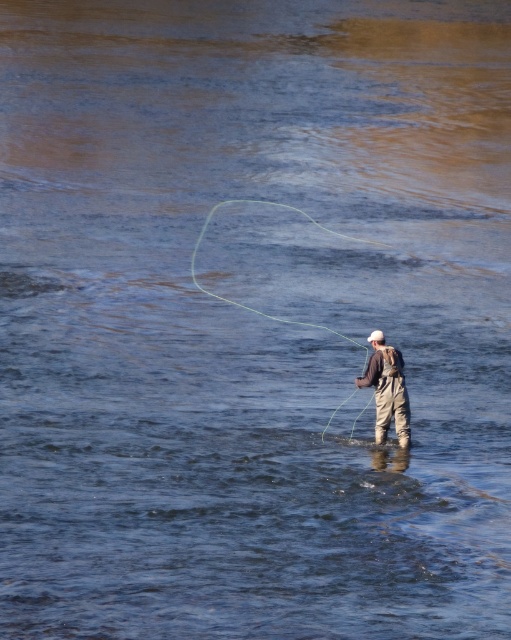
Which is above, khaki waterproof waders at center or green rubber string at center?

green rubber string at center

Does point (400, 385) come closer to viewer compared to point (206, 225)?

Yes, point (400, 385) is closer to viewer.

Identify the location of khaki waterproof waders at center. This screenshot has width=511, height=640. (387, 388).

Where is `khaki waterproof waders at center`? khaki waterproof waders at center is located at coordinates (387, 388).